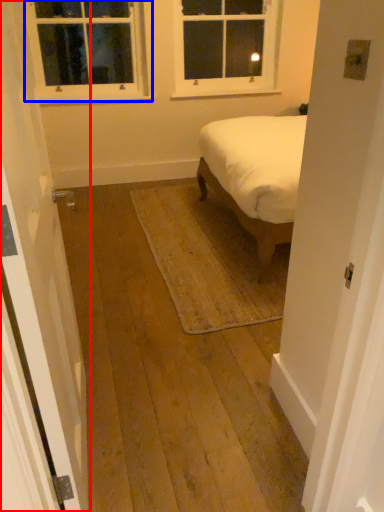
Question: Which object is closer to the camera taking this photo, door (highlighted by a red box) or window (highlighted by a blue box)?

Choices:
 (A) door
 (B) window

Answer: (A)